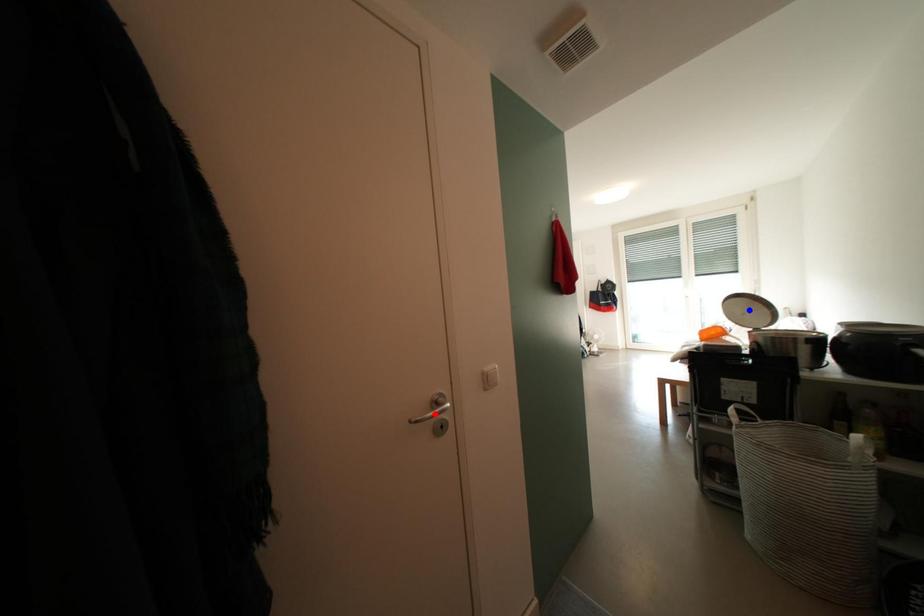
Question: In the image, two points are highlighted. Which point is nearer to the camera? Reply with the corresponding letter.

Choices:
 (A) blue point
 (B) red point

Answer: (B)